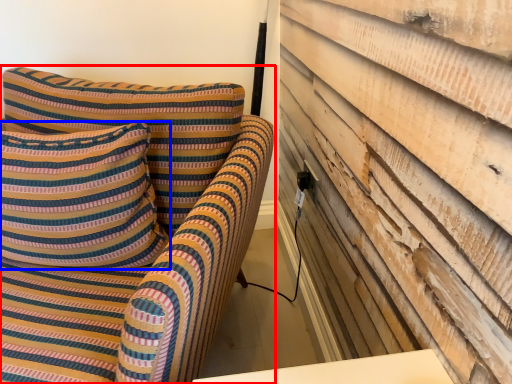
Question: Which object appears closest to the camera in this image, furniture (highlighted by a red box) or pillow (highlighted by a blue box)?

Choices:
 (A) furniture
 (B) pillow

Answer: (A)